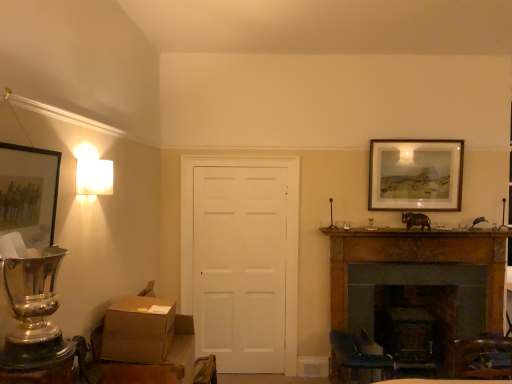
Question: In the image, is brown cardboard box at lower left on the left side or the right side of white matte door at center?

Choices:
 (A) left
 (B) right

Answer: (A)

Question: From the image's perspective, is brown cardboard box at lower left located above or below white matte door at center?

Choices:
 (A) above
 (B) below

Answer: (B)

Question: Which object is the farthest from the wooden picture frame at upper right, the second picture frame viewed from the front?

Choices:
 (A) matte black picture frame at left, which ranks as the first picture frame in left-to-right order
 (B) white matte square lamp at upper left
 (C) white matte door at center
 (D) brown cardboard box at lower left
 (E) wooden fireplace at lower right

Answer: (A)

Question: Considering the real-world distances, which object is closest to the brown cardboard box at lower left?

Choices:
 (A) white matte door at center
 (B) wooden fireplace at lower right
 (C) white matte square lamp at upper left
 (D) matte black picture frame at left, placed as the 2th picture frame when sorted from right to left
 (E) wooden picture frame at upper right, the second picture frame viewed from the front

Answer: (C)